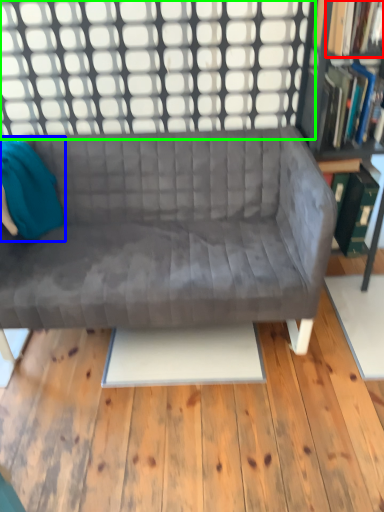
Question: Which object is the closest to the book (highlighted by a red box)? Choose among these: bean bag chair (highlighted by a blue box) or window (highlighted by a green box).

Choices:
 (A) bean bag chair
 (B) window

Answer: (B)